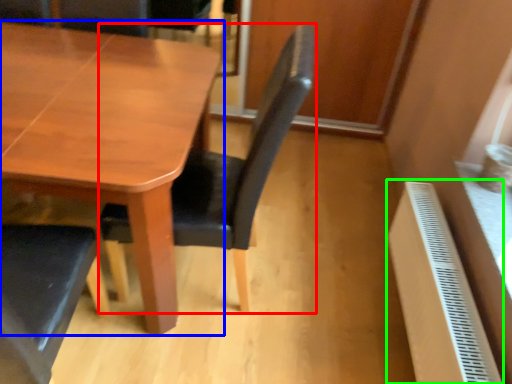
Question: Which is nearer to the chair (highlighted by a red box)? table (highlighted by a blue box) or radiator (highlighted by a green box).

Choices:
 (A) table
 (B) radiator

Answer: (A)